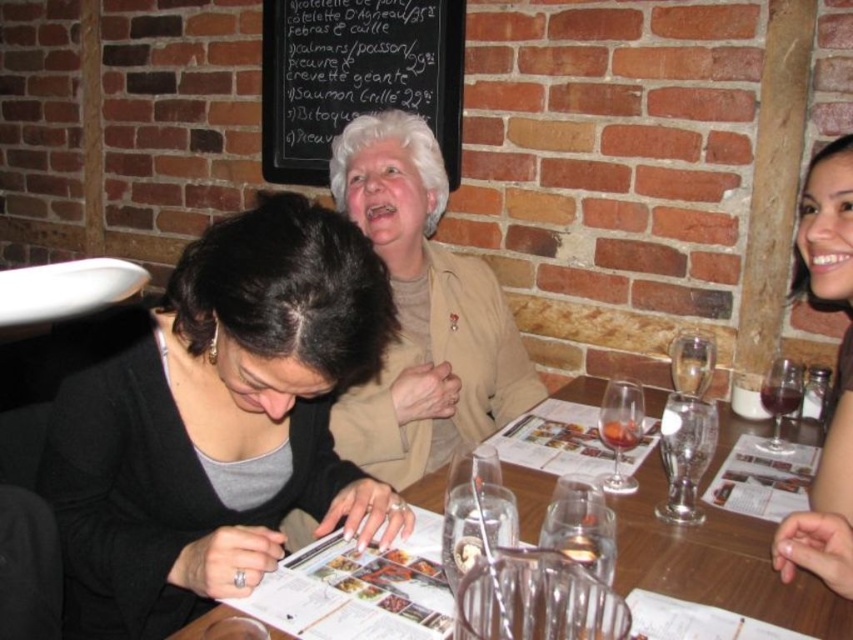
Question: Is the position of black matte sweater at center more distant than that of translucent glass wine glass at right?

Choices:
 (A) yes
 (B) no

Answer: (B)

Question: Which of the following is the farthest from the observer?

Choices:
 (A) (640, 429)
 (B) (837, 595)
 (C) (691, 339)
 (D) (289, 49)

Answer: (D)

Question: Estimate the real-world distances between objects in this image. Which object is farther from the translucent glass wine at upper right?

Choices:
 (A) translucent glass wine glass at right
 (B) black matte sweater at center
 (C) clear glass at center
 (D) clear glass wine glass at table center

Answer: (B)

Question: Does light beige jacket at center appear under clear glass at center?

Choices:
 (A) yes
 (B) no

Answer: (B)

Question: Which point is farther from the camera taking this photo?

Choices:
 (A) (778, 570)
 (B) (383, 164)

Answer: (B)

Question: Does translucent glass wine glass at center appear under translucent glass at table center?

Choices:
 (A) no
 (B) yes

Answer: (A)